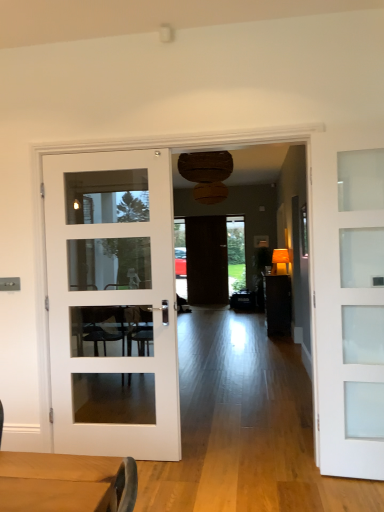
Measure the distance between green glass window at right and camera.

They are 17.99 feet apart.

At what (x,y) coordinates should I click in order to perform the action: click on green glass window at right. Please return your answer as a coordinate pair (x, y). The height and width of the screenshot is (512, 384). Looking at the image, I should click on (304, 232).

Describe the element at coordinates (277, 304) in the screenshot. I see `matte brown table at center` at that location.

The image size is (384, 512). What are the coordinates of `dark wood door at center, which appears as the second door when viewed from the right` in the screenshot? It's located at (206, 260).

Is matte brown table at center outside of green glass window at right?

matte brown table at center lies outside green glass window at right's area.

Can you tell me how much matte brown table at center and green glass window at right differ in facing direction?

2.08 degrees.

Is matte brown table at center taller or shorter than green glass window at right?

In the image, matte brown table at center appears to be taller than green glass window at right.

Do you think green glass window at right is within dark wood door at center, which appears as the second door when viewed from the right, or outside of it?

green glass window at right lies outside dark wood door at center, which appears as the second door when viewed from the right.

Does green glass window at right have a lesser width compared to dark wood door at center, the 2th door from the left?

Incorrect, the width of green glass window at right is not less than that of dark wood door at center, the 2th door from the left.

From the image's perspective, would you say green glass window at right is positioned over dark wood door at center, which is the 1th door in back-to-front order?

Correct, green glass window at right appears higher than dark wood door at center, which is the 1th door in back-to-front order, in the image.

Looking at the image, does green glass window at right seem bigger or smaller compared to dark wood door at center, which is the 1th door in back-to-front order?

Considering their sizes, green glass window at right takes up less space than dark wood door at center, which is the 1th door in back-to-front order.

Is white glass door at left, the 3th door when ordered from right to left, oriented towards white frosted glass door at right, the 3th door from the left?

No.

Is white glass door at left, arranged as the second door when viewed from the back, not close to white frosted glass door at right, placed as the first door when sorted from front to back?

That's right, there is a large distance between white glass door at left, arranged as the second door when viewed from the back, and white frosted glass door at right, placed as the first door when sorted from front to back.

Which is more to the left, white glass door at left, arranged as the second door when viewed from the back, or white frosted glass door at right, the third door positioned from the back?

white glass door at left, arranged as the second door when viewed from the back.

Measure the distance between white glass door at left, acting as the 1th door starting from the left, and white frosted glass door at right, the third door positioned from the back.

white glass door at left, acting as the 1th door starting from the left, is 5.35 feet away from white frosted glass door at right, the third door positioned from the back.

Considering the positions of objects matte brown table at center and dark wood door at center, the 2th door from the left, in the image provided, who is more to the right, matte brown table at center or dark wood door at center, the 2th door from the left,?

From the viewer's perspective, matte brown table at center appears more on the right side.

Is matte brown table at center not inside dark wood door at center, which appears as the second door when viewed from the right?

Yes.

Does matte brown table at center have a smaller size compared to dark wood door at center, the 3th door from the front?

No, matte brown table at center is not smaller than dark wood door at center, the 3th door from the front.

From a real-world perspective, between white frosted glass door at right, the third door positioned from the back, and green glass window at right, who is vertically higher?

From a 3D spatial view, green glass window at right is above.

Can you confirm if white frosted glass door at right, the third door positioned from the back, is thinner than green glass window at right?

No, white frosted glass door at right, the third door positioned from the back, is not thinner than green glass window at right.

Measure the distance from white frosted glass door at right, placed as the first door when sorted from front to back, to green glass window at right.

white frosted glass door at right, placed as the first door when sorted from front to back, is 10.39 feet from green glass window at right.

Can you see white frosted glass door at right, the third door positioned from the back, touching green glass window at right?

white frosted glass door at right, the third door positioned from the back, and green glass window at right are clearly separated.

Which of these two, dark wood door at center, the 2th door from the left, or white glass door at left, the 2th door positioned from the front, is smaller?

dark wood door at center, the 2th door from the left.

Is dark wood door at center, which appears as the second door when viewed from the right, positioned beyond the bounds of white glass door at left, the 3th door when ordered from right to left?

That's correct, dark wood door at center, which appears as the second door when viewed from the right, is outside of white glass door at left, the 3th door when ordered from right to left.

From a real-world perspective, is dark wood door at center, the 2th door from the left, above or below white glass door at left, acting as the 1th door starting from the left?

In terms of real-world spatial position, dark wood door at center, the 2th door from the left, is above white glass door at left, acting as the 1th door starting from the left.

Is dark wood door at center, which appears as the second door when viewed from the right, oriented away from white glass door at left, arranged as the second door when viewed from the back?

No, dark wood door at center, which appears as the second door when viewed from the right, is not facing away from white glass door at left, arranged as the second door when viewed from the back.

Is green glass window at right looking in the opposite direction of matte brown table at center?

No.

Is matte brown table at center located within green glass window at right?

No, matte brown table at center is located outside of green glass window at right.

Considering their positions, is green glass window at right located in front of or behind matte brown table at center?

green glass window at right is in front of matte brown table at center.

In the scene shown: Is green glass window at right at the right side of matte brown table at center?

In fact, green glass window at right is to the left of matte brown table at center.

Identify the location of window above the matte brown table at center (from a real-world perspective). (304, 232).

This screenshot has height=512, width=384. I want to click on door behind the green glass window at right, so click(206, 260).

From the image, which object appears to be farther from dark wood door at center, which is the 1th door in back-to-front order, matte brown table at center or white frosted glass door at right, placed as the first door when sorted from front to back?

white frosted glass door at right, placed as the first door when sorted from front to back.

Based on their spatial positions, is dark wood door at center, the 3th door from the front, or white frosted glass door at right, the third door positioned from the back, further from white glass door at left, the 2th door positioned from the front?

dark wood door at center, the 3th door from the front, is further to white glass door at left, the 2th door positioned from the front.

Based on their spatial positions, is green glass window at right or white frosted glass door at right, the 1th door viewed from the right, further from matte brown table at center?

white frosted glass door at right, the 1th door viewed from the right, is positioned further to the anchor matte brown table at center.

Looking at the image, which one is located further to white frosted glass door at right, the 3th door from the left, matte brown table at center or dark wood door at center, the 2th door from the left?

Based on the image, dark wood door at center, the 2th door from the left, appears to be further to white frosted glass door at right, the 3th door from the left.

Based on their spatial positions, is white glass door at left, the 3th door when ordered from right to left, or dark wood door at center, the 2th door from the left, further from white frosted glass door at right, the 3th door from the left?

The object further to white frosted glass door at right, the 3th door from the left, is dark wood door at center, the 2th door from the left.

When comparing their distances from matte brown table at center, does white frosted glass door at right, the third door positioned from the back, or green glass window at right seem closer?

Among the two, green glass window at right is located nearer to matte brown table at center.

Which object lies nearer to the anchor point matte brown table at center, dark wood door at center, the 2th door from the left, or white frosted glass door at right, placed as the first door when sorted from front to back?

The object closer to matte brown table at center is dark wood door at center, the 2th door from the left.

Estimate the real-world distances between objects in this image. Which object is further from dark wood door at center, the 3th door from the front, white frosted glass door at right, the 1th door viewed from the right, or green glass window at right?

white frosted glass door at right, the 1th door viewed from the right, lies further to dark wood door at center, the 3th door from the front, than the other object.

Identify the location of table positioned between green glass window at right and dark wood door at center, the 2th door from the left, from near to far. (277, 304).

At what (x,y) coordinates should I click in order to perform the action: click on window between white glass door at left, the 2th door positioned from the front, and matte brown table at center, along the z-axis. Please return your answer as a coordinate pair (x, y). Looking at the image, I should click on (304, 232).

This screenshot has height=512, width=384. I want to click on door between white frosted glass door at right, placed as the first door when sorted from front to back, and matte brown table at center, along the z-axis, so click(x=112, y=304).

Identify the location of window between white glass door at left, arranged as the second door when viewed from the back, and dark wood door at center, the 3th door from the front, from front to back. This screenshot has width=384, height=512. (304, 232).